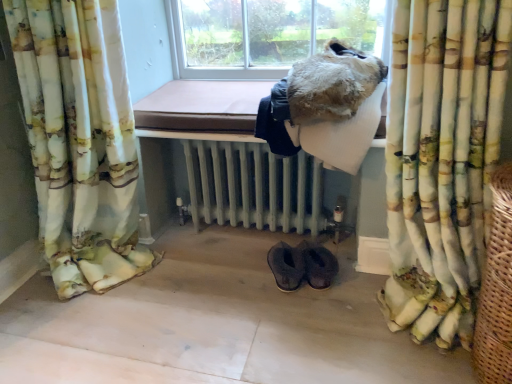
The height and width of the screenshot is (384, 512). What are the coordinates of `brown suede slippers at lower center` in the screenshot? It's located at (302, 265).

The width and height of the screenshot is (512, 384). In order to click on floral fabric curtain at left, the 2th curtain in the right-to-left sequence in this screenshot , I will do `click(80, 140)`.

In order to click on white painted radiator at center in this screenshot , I will do `click(252, 187)`.

Describe the element at coordinates (496, 289) in the screenshot. I see `woven brown basket at right` at that location.

This screenshot has height=384, width=512. Find the location of `printed fabric curtain at right, acting as the 2th curtain starting from the left`. printed fabric curtain at right, acting as the 2th curtain starting from the left is located at coordinates (442, 159).

You are a GUI agent. You are given a task and a screenshot of the screen. Output one action in this format:
    pyautogui.click(x=<x>, y=<y>)
    Task: Click on the brown suede slippers at lower center
    Image resolution: width=512 pixels, height=384 pixels.
    Given the screenshot: What is the action you would take?
    pyautogui.click(x=302, y=265)

Does floral fabric curtain at left, which appears as the 1th curtain when viewed from the left, have a greater width compared to white painted radiator at center?

No, floral fabric curtain at left, which appears as the 1th curtain when viewed from the left, is not wider than white painted radiator at center.

Who is more distant, floral fabric curtain at left, which appears as the 1th curtain when viewed from the left, or white painted radiator at center?

white painted radiator at center.

In the scene shown: Is floral fabric curtain at left, which appears as the 1th curtain when viewed from the left, smaller than white painted radiator at center?

Incorrect, floral fabric curtain at left, which appears as the 1th curtain when viewed from the left, is not smaller in size than white painted radiator at center.

Is floral fabric curtain at left, the 2th curtain in the right-to-left sequence, facing towards white painted radiator at center?

No, floral fabric curtain at left, the 2th curtain in the right-to-left sequence, is not aimed at white painted radiator at center.

Based on their positions, is brown suede slippers at lower center located to the left or right of woven brown basket at right?

In the image, brown suede slippers at lower center appears on the left side of woven brown basket at right.

Which point is more distant from viewer, (272, 247) or (478, 312)?

The point (272, 247) is farther from the camera.

Is brown suede slippers at lower center in contact with woven brown basket at right?

They are not placed beside each other.

Who is taller, brown suede slippers at lower center or woven brown basket at right?

woven brown basket at right is taller.

Between point (275, 211) and point (287, 132), which one is positioned in front?

Point (287, 132)

Are white painted radiator at center and fuzzy fur coat at upper center making contact?

There is a gap between white painted radiator at center and fuzzy fur coat at upper center.

Which of these two, white painted radiator at center or fuzzy fur coat at upper center, stands taller?

white painted radiator at center.

Consider the image. From a real-world perspective, is white painted radiator at center under fuzzy fur coat at upper center?

Correct, in the physical world, white painted radiator at center is lower than fuzzy fur coat at upper center.

Can you confirm if fuzzy fur coat at upper center is positioned to the right of floral fabric curtain at left, which appears as the 1th curtain when viewed from the left?

Indeed, fuzzy fur coat at upper center is positioned on the right side of floral fabric curtain at left, which appears as the 1th curtain when viewed from the left.

From the picture: Which is nearer, (263, 117) or (71, 148)?

Point (263, 117) is positioned closer to the camera compared to point (71, 148).

Is fuzzy fur coat at upper center smaller than floral fabric curtain at left, which appears as the 1th curtain when viewed from the left?

Indeed, fuzzy fur coat at upper center has a smaller size compared to floral fabric curtain at left, which appears as the 1th curtain when viewed from the left.

Does fuzzy fur coat at upper center turn towards floral fabric curtain at left, the 2th curtain in the right-to-left sequence?

No, fuzzy fur coat at upper center is not turned towards floral fabric curtain at left, the 2th curtain in the right-to-left sequence.

Looking at this image, from a real-world perspective, who is located lower, white painted radiator at center or woven brown basket at right?

In real-world perspective, white painted radiator at center is lower.

Which of these two, white painted radiator at center or woven brown basket at right, is bigger?

With larger size is woven brown basket at right.

Which is correct: white painted radiator at center is inside woven brown basket at right, or outside of it?

white painted radiator at center is outside woven brown basket at right.

Between point (208, 191) and point (506, 182), which one is positioned in front?

The point (506, 182) is closer.

Is white painted radiator at center turned away from floral fabric curtain at left, the 2th curtain in the right-to-left sequence?

white painted radiator at center does not have its back to floral fabric curtain at left, the 2th curtain in the right-to-left sequence.

Is white painted radiator at center located outside floral fabric curtain at left, which appears as the 1th curtain when viewed from the left?

Yes, white painted radiator at center is not within floral fabric curtain at left, which appears as the 1th curtain when viewed from the left.

Is point (244, 175) closer to viewer compared to point (123, 201)?

No, (244, 175) is further to viewer.

Considering the positions of objects woven brown basket at right and fuzzy fur coat at upper center in the image provided, who is more to the left, woven brown basket at right or fuzzy fur coat at upper center?

Positioned to the left is fuzzy fur coat at upper center.

Does woven brown basket at right come in front of fuzzy fur coat at upper center?

Yes, it is.

Is woven brown basket at right turned away from fuzzy fur coat at upper center?

woven brown basket at right is not turned away from fuzzy fur coat at upper center.

From the image's perspective, between woven brown basket at right and fuzzy fur coat at upper center, who is located below?

From the image's view, woven brown basket at right is below.

I want to click on radiator located below the floral fabric curtain at left, the 2th curtain in the right-to-left sequence (from the image's perspective), so click(x=252, y=187).

At what (x,y) coordinates should I click in order to perform the action: click on basket above the brown suede slippers at lower center (from the image's perspective). Please return your answer as a coordinate pair (x, y). This screenshot has width=512, height=384. Looking at the image, I should click on (496, 289).

Looking at the image, which one is located closer to floral fabric curtain at left, the 2th curtain in the right-to-left sequence, brown suede slippers at lower center or woven brown basket at right?

Among the two, brown suede slippers at lower center is located nearer to floral fabric curtain at left, the 2th curtain in the right-to-left sequence.

When comparing their distances from fuzzy fur coat at upper center, does white painted radiator at center or brown suede slippers at lower center seem closer?

white painted radiator at center is positioned closer to the anchor fuzzy fur coat at upper center.

Considering their positions, is brown suede slippers at lower center positioned closer to white painted radiator at center than fuzzy fur coat at upper center?

Among the two, brown suede slippers at lower center is located nearer to white painted radiator at center.

Estimate the real-world distances between objects in this image. Which object is further from printed fabric curtain at right, which is counted as the first curtain, starting from the right, floral fabric curtain at left, which appears as the 1th curtain when viewed from the left, or fuzzy fur coat at upper center?

floral fabric curtain at left, which appears as the 1th curtain when viewed from the left, lies further to printed fabric curtain at right, which is counted as the first curtain, starting from the right, than the other object.

Estimate the real-world distances between objects in this image. Which object is further from brown suede slippers at lower center, fuzzy fur coat at upper center or white painted radiator at center?

The object further to brown suede slippers at lower center is fuzzy fur coat at upper center.

Considering their positions, is white painted radiator at center positioned closer to printed fabric curtain at right, which is counted as the first curtain, starting from the right, than fuzzy fur coat at upper center?

fuzzy fur coat at upper center.

Estimate the real-world distances between objects in this image. Which object is further from woven brown basket at right, white painted radiator at center or printed fabric curtain at right, which is counted as the first curtain, starting from the right?

white painted radiator at center lies further to woven brown basket at right than the other object.

Consider the image. Estimate the real-world distances between objects in this image. Which object is closer to floral fabric curtain at left, which appears as the 1th curtain when viewed from the left, woven brown basket at right or printed fabric curtain at right, acting as the 2th curtain starting from the left?

Among the two, printed fabric curtain at right, acting as the 2th curtain starting from the left, is located nearer to floral fabric curtain at left, which appears as the 1th curtain when viewed from the left.

Find the location of `footwear between floral fabric curtain at left, which appears as the 1th curtain when viewed from the left, and printed fabric curtain at right, which is counted as the first curtain, starting from the right, from left to right`. footwear between floral fabric curtain at left, which appears as the 1th curtain when viewed from the left, and printed fabric curtain at right, which is counted as the first curtain, starting from the right, from left to right is located at coordinates [302, 265].

This screenshot has width=512, height=384. Find the location of `radiator situated between floral fabric curtain at left, which appears as the 1th curtain when viewed from the left, and fuzzy fur coat at upper center from left to right`. radiator situated between floral fabric curtain at left, which appears as the 1th curtain when viewed from the left, and fuzzy fur coat at upper center from left to right is located at coordinates (252, 187).

What are the coordinates of `animal between floral fabric curtain at left, the 2th curtain in the right-to-left sequence, and printed fabric curtain at right, which is counted as the first curtain, starting from the right` in the screenshot? It's located at (317, 94).

Locate an element on the screen. The width and height of the screenshot is (512, 384). radiator between floral fabric curtain at left, which appears as the 1th curtain when viewed from the left, and woven brown basket at right from left to right is located at coordinates (252, 187).